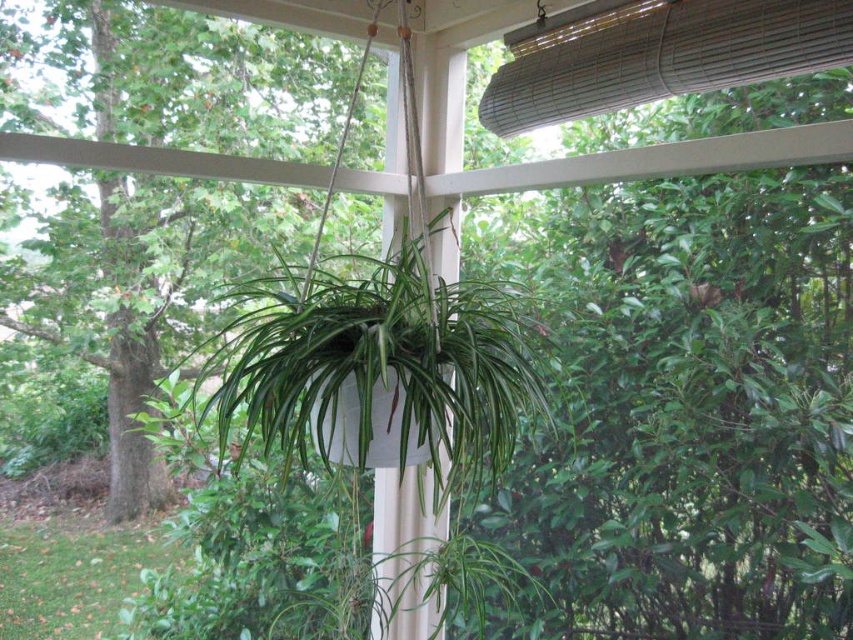
Question: Is green matte hanging plant at center below bamboo blind at upper center?

Choices:
 (A) no
 (B) yes

Answer: (B)

Question: Which point is closer to the camera taking this photo?

Choices:
 (A) (840, 52)
 (B) (454, 444)
 (C) (263, 74)

Answer: (B)

Question: Which point is closer to the camera?

Choices:
 (A) (49, 244)
 (B) (532, 125)

Answer: (B)

Question: Can you confirm if green leafy tree at center is positioned to the left of green matte hanging plant at center?

Choices:
 (A) no
 (B) yes

Answer: (B)

Question: Is green matte hanging plant at center positioned behind bamboo blind at upper center?

Choices:
 (A) yes
 (B) no

Answer: (B)

Question: Estimate the real-world distances between objects in this image. Which object is closer to the green leafy tree at center?

Choices:
 (A) green matte hanging plant at center
 (B) bamboo blind at upper center

Answer: (A)